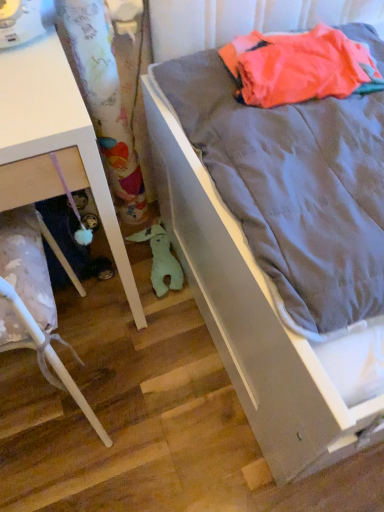
Question: Is wooden floor at lower left to the left or to the right of gray fabric bed at right in the image?

Choices:
 (A) left
 (B) right

Answer: (A)

Question: Is wooden floor at lower left situated inside gray fabric bed at right or outside?

Choices:
 (A) outside
 (B) inside

Answer: (A)

Question: Estimate the real-world distances between objects in this image. Which object is farther from the wooden floor at lower left?

Choices:
 (A) gray fabric bed at right
 (B) white glossy drawer at lower left, which is counted as the first furniture, starting from the bottom
 (C) green plush toy at lower center
 (D) white glossy drawer at lower left, the first furniture in the top-to-bottom sequence

Answer: (A)

Question: Which object is positioned closest to the green plush toy at lower center?

Choices:
 (A) white glossy drawer at lower left, which is counted as the first furniture, starting from the bottom
 (B) white glossy drawer at lower left, the 2th furniture in the bottom-to-top sequence
 (C) wooden floor at lower left
 (D) gray fabric bed at right

Answer: (C)